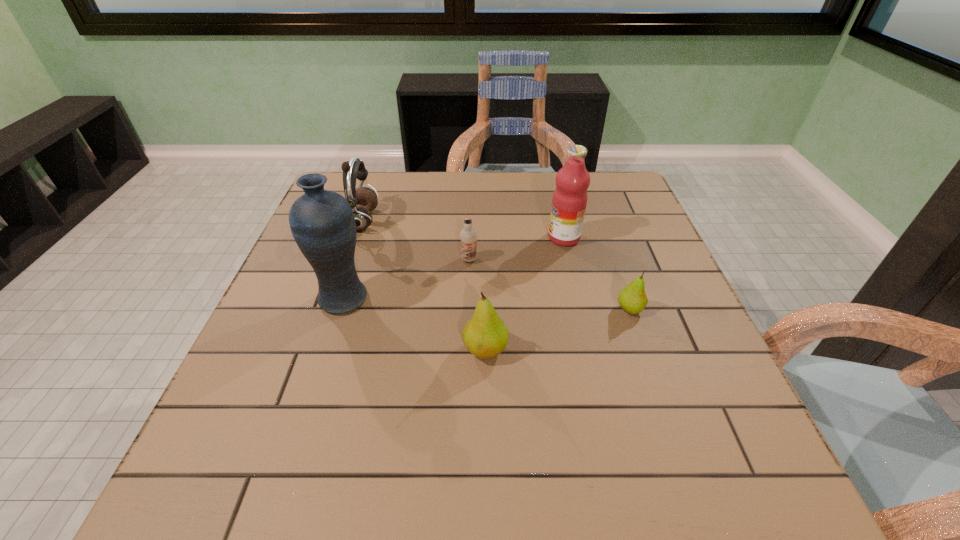
At what (x,y) coordinates should I click in order to perform the action: click on empty location between the chocolate milk and the right pear. Please return your answer as a coordinate pair (x, y). This screenshot has height=540, width=960. Looking at the image, I should click on (549, 285).

Where is `free space between the shorter pear and the fifth shortest object`? The image size is (960, 540). free space between the shorter pear and the fifth shortest object is located at coordinates (597, 274).

Find the location of a particular element. empty space between the right pear and the fourth nearest object is located at coordinates (549, 285).

I want to click on free area in between the vase and the nearest object, so click(x=415, y=324).

The image size is (960, 540). Identify the location of object that is the second closest to the fruit juice. (632, 298).

In order to click on the second closest object to the chocolate milk in this screenshot , I will do `click(322, 222)`.

This screenshot has width=960, height=540. Identify the location of free space that satisfies the following two spatial constraints: 1. on the front side of the chocolate milk; 2. on the left side of the farther pear. (468, 309).

Find the location of a particular element. free space that satisfies the following two spatial constraints: 1. on the label of the fruit juice; 2. on the right side of the right pear is located at coordinates (581, 309).

Where is `free space that satisfies the following two spatial constraints: 1. on the back side of the tallest object; 2. on the ear pads of the third tallest object`? free space that satisfies the following two spatial constraints: 1. on the back side of the tallest object; 2. on the ear pads of the third tallest object is located at coordinates (369, 221).

Locate an element on the screen. vacant region that satisfies the following two spatial constraints: 1. on the ear pads of the third farthest object; 2. on the left side of the earphone is located at coordinates (350, 260).